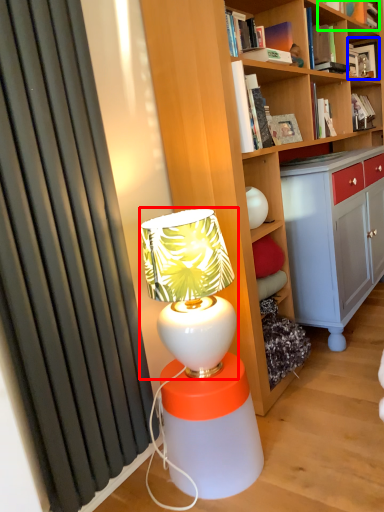
Question: Estimate the real-world distances between objects in this image. Which object is closer to table lamp (highlighted by a red box), book (highlighted by a blue box) or book (highlighted by a green box)?

Choices:
 (A) book
 (B) book

Answer: (B)